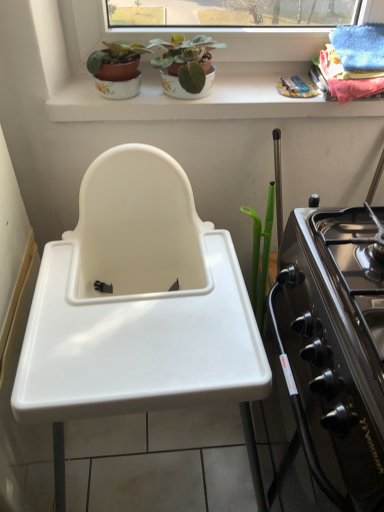
Question: Is matte ceramic pot at upper center, acting as the second houseplant starting from the right, inside the boundaries of white plastic sink at center, or outside?

Choices:
 (A) inside
 (B) outside

Answer: (B)

Question: Is point (124, 65) closer or farther from the camera than point (96, 205)?

Choices:
 (A) closer
 (B) farther

Answer: (B)

Question: Estimate the real-world distances between objects in this image. Which object is closer to the white plastic sink at center?

Choices:
 (A) matte ceramic pot at upper center, acting as the 1th houseplant starting from the right
 (B) white ceramic window sill at upper center
 (C) black glossy oven at right
 (D) matte ceramic pot at upper center, marked as the first houseplant in a left-to-right arrangement

Answer: (C)

Question: Which object is the farthest from the black glossy oven at right?

Choices:
 (A) matte ceramic pot at upper center, acting as the 1th houseplant starting from the right
 (B) white plastic sink at center
 (C) matte ceramic pot at upper center, acting as the second houseplant starting from the right
 (D) white ceramic window sill at upper center

Answer: (C)